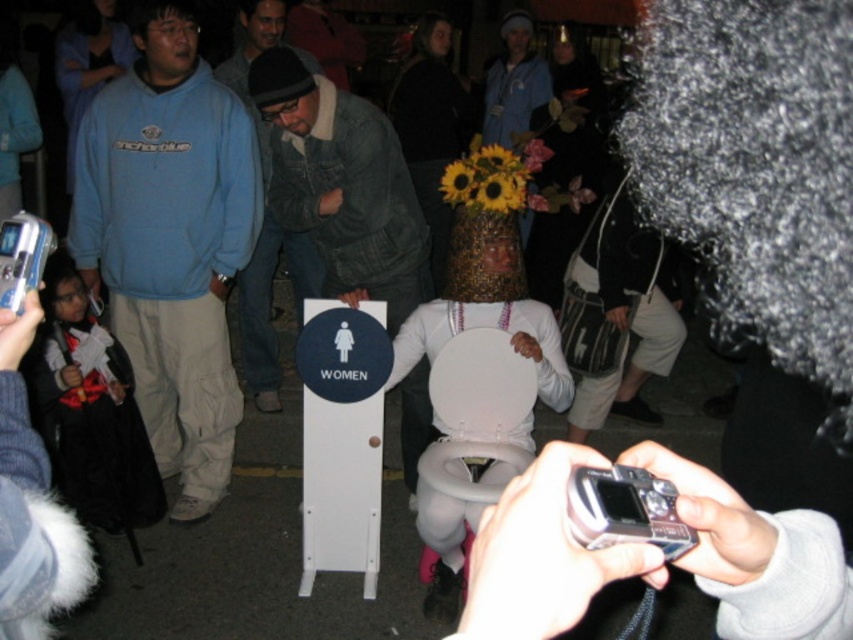
You are trying to decide which clothing item to take with you. The blue fleece sweatshirt at left and the denim jacket at center are both available. Which one is wider?

The blue fleece sweatshirt at left is wider than the denim jacket at center.